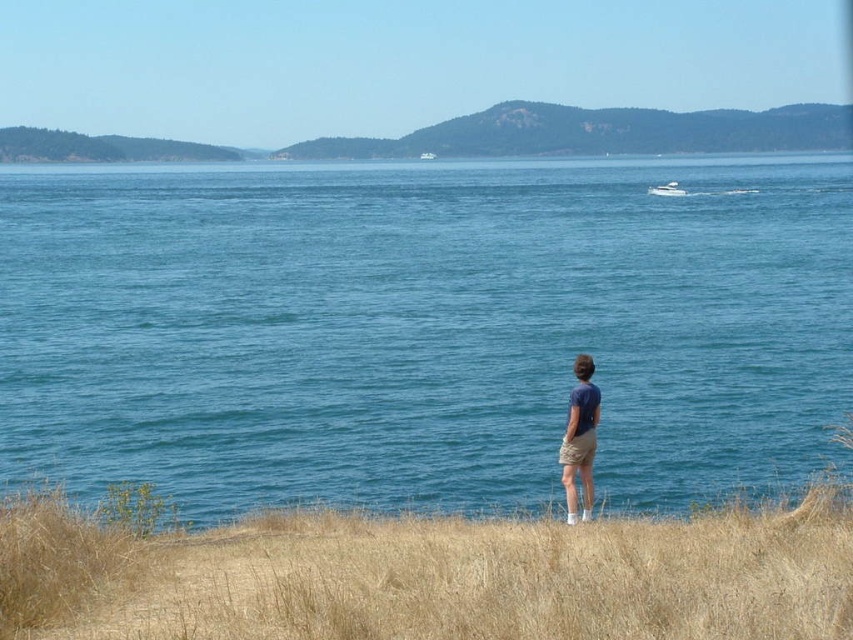
Is point (358, 500) closer to viewer compared to point (577, 376)?

No, (358, 500) is behind (577, 376).

Which is more to the left, blue water at center or blue cotton shirt at center?

blue water at center is more to the left.

This screenshot has width=853, height=640. Find the location of `blue water at center`. blue water at center is located at coordinates (422, 328).

Which is above, green grassy hillside at upper center or blue cotton shirt at center?

Positioned higher is green grassy hillside at upper center.

Can you confirm if green grassy hillside at upper center is thinner than blue cotton shirt at center?

Incorrect, green grassy hillside at upper center's width is not less than blue cotton shirt at center's.

At what (x,y) coordinates should I click in order to perform the action: click on green grassy hillside at upper center. Please return your answer as a coordinate pair (x, y). The height and width of the screenshot is (640, 853). Looking at the image, I should click on (601, 132).

What do you see at coordinates (601, 132) in the screenshot? The image size is (853, 640). I see `green grassy hillside at upper center` at bounding box center [601, 132].

Between green grassy hillside at upper center and white glossy boat at upper right, which one is positioned lower?

white glossy boat at upper right is lower down.

At what (x,y) coordinates should I click in order to perform the action: click on green grassy hillside at upper center. Please return your answer as a coordinate pair (x, y). Looking at the image, I should click on (601, 132).